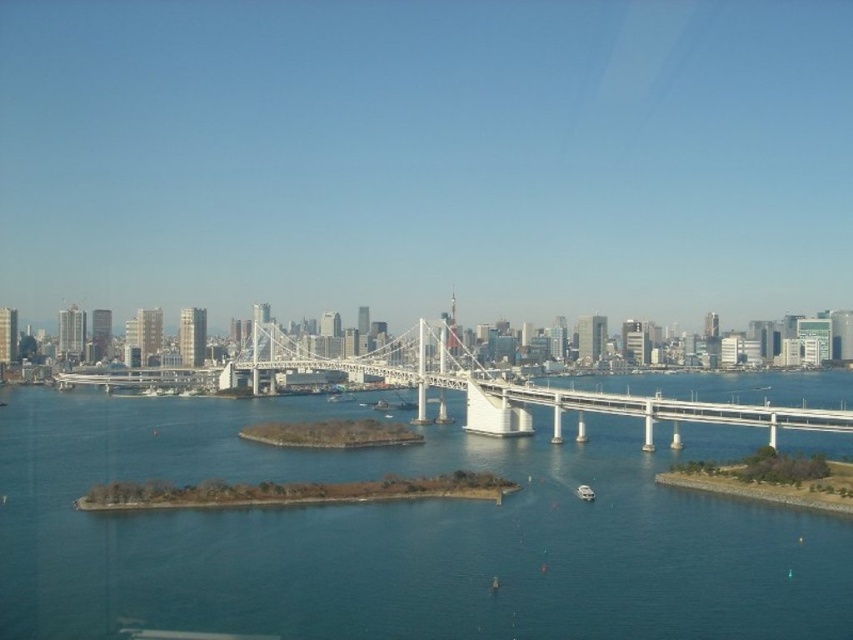
Question: Observing the image, what is the correct spatial positioning of blue water at center in reference to white metallic bridge at center?

Choices:
 (A) below
 (B) above

Answer: (A)

Question: Does blue water at center have a lesser width compared to white metallic bridge at center?

Choices:
 (A) yes
 (B) no

Answer: (B)

Question: Can you confirm if blue water at center is wider than white metallic bridge at center?

Choices:
 (A) no
 (B) yes

Answer: (B)